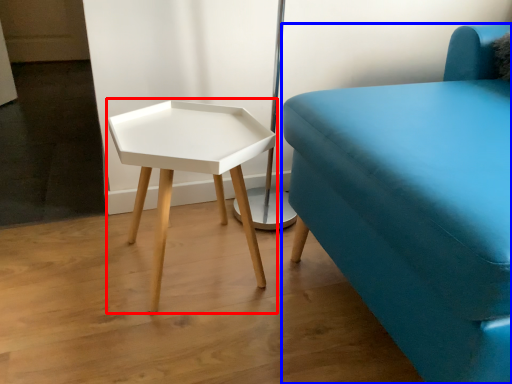
Question: Which point is further to the camera, table (highlighted by a red box) or studio couch (highlighted by a blue box)?

Choices:
 (A) table
 (B) studio couch

Answer: (A)